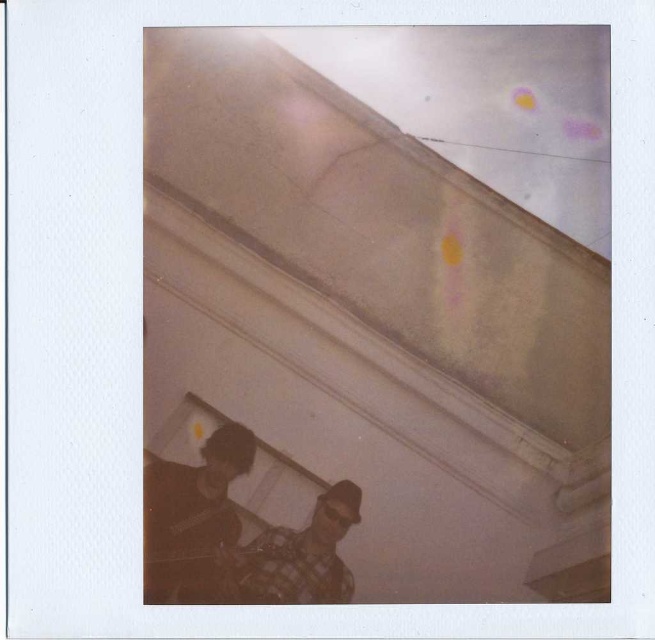
Which of these two, dark brown leather jacket at lower left or checkered fabric shirt at lower center, stands taller?

With more height is dark brown leather jacket at lower left.

Is dark brown leather jacket at lower left behind checkered fabric shirt at lower center?

No.

Find the location of a particular element. dark brown leather jacket at lower left is located at coordinates (191, 516).